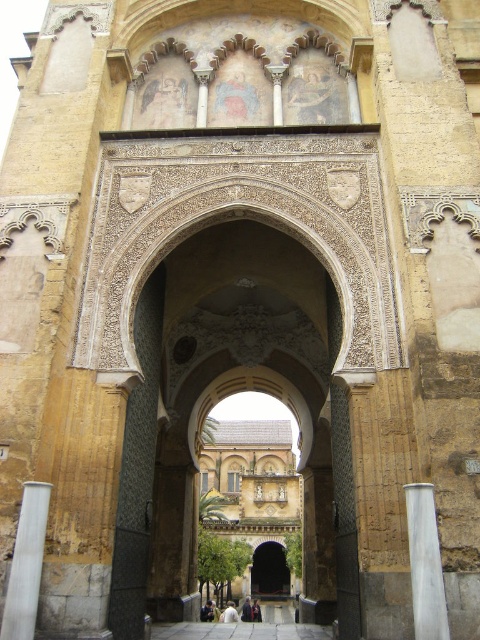
Question: Which point is closer to the camera?

Choices:
 (A) (434, 618)
 (B) (263, 548)

Answer: (A)

Question: In this image, where is white marble pillar at center located relative to dark brown wooden door at center?

Choices:
 (A) left
 (B) right

Answer: (B)

Question: Where is white stone pillar at lower left located in relation to dark brown wooden door at center in the image?

Choices:
 (A) below
 (B) above

Answer: (B)

Question: Which object is positioned farthest from the dark brown wooden door at center?

Choices:
 (A) white stone pillar at lower left
 (B) white marble pillar at center

Answer: (A)

Question: Is white marble pillar at center to the right of dark brown wooden door at center from the viewer's perspective?

Choices:
 (A) no
 (B) yes

Answer: (B)

Question: Which of the following is the closest to the observer?

Choices:
 (A) (27, 593)
 (B) (441, 612)
 (C) (288, 588)

Answer: (B)